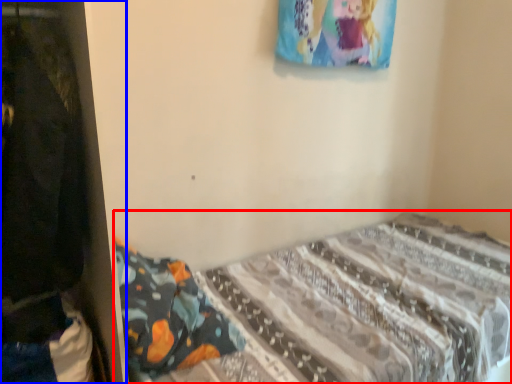
Question: Which of the following is the farthest to the observer, bed (highlighted by a red box) or closet (highlighted by a blue box)?

Choices:
 (A) bed
 (B) closet

Answer: (A)